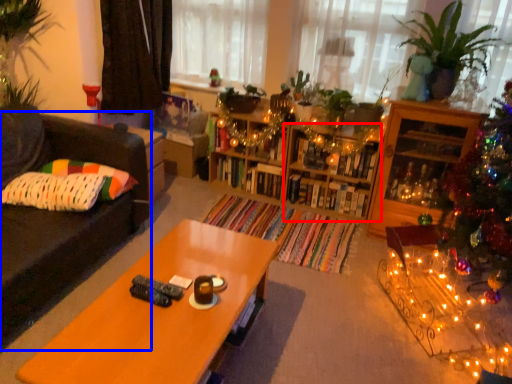
Question: Which of the following is the closest to the observer, shelf (highlighted by a red box) or studio couch (highlighted by a blue box)?

Choices:
 (A) shelf
 (B) studio couch

Answer: (B)